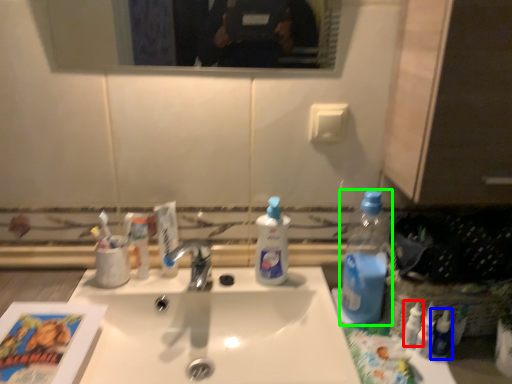
Question: Based on their relative distances, which object is nearer to toiletry (highlighted by a red box)? Choose from toiletry (highlighted by a blue box) and bottle (highlighted by a green box).

Choices:
 (A) toiletry
 (B) bottle

Answer: (A)